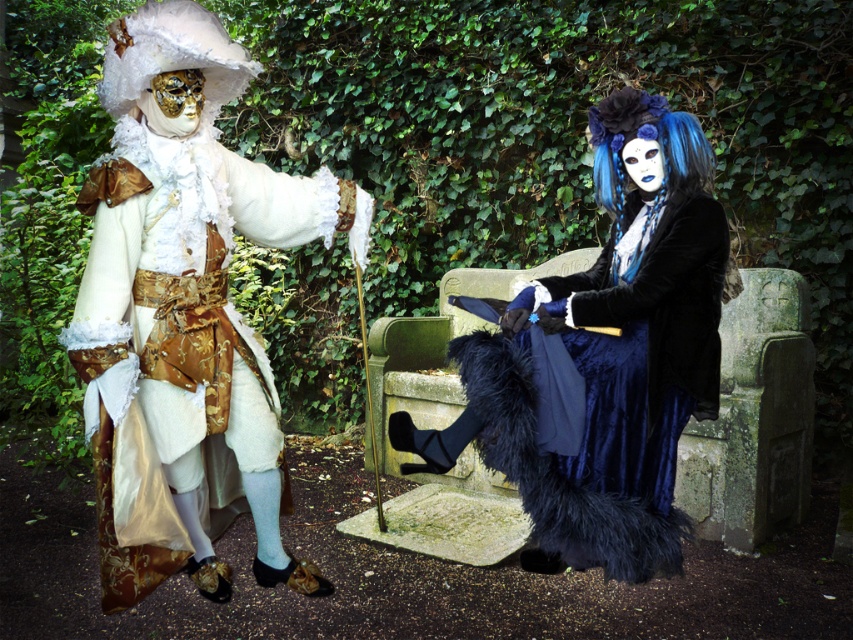
Question: Does matte gold fabric coat at left appear over velvet blue dress at center?

Choices:
 (A) no
 (B) yes

Answer: (B)

Question: Is matte gold fabric coat at left below velvet blue dress at center?

Choices:
 (A) no
 (B) yes

Answer: (A)

Question: Which object is farther from the camera taking this photo?

Choices:
 (A) matte gold fabric coat at left
 (B) velvet blue dress at center

Answer: (B)

Question: Does matte gold fabric coat at left have a lesser width compared to velvet blue dress at center?

Choices:
 (A) yes
 (B) no

Answer: (A)